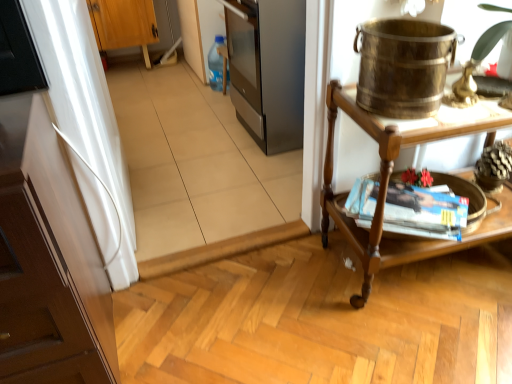
Question: Considering the relative sizes of brass metallic bucket at upper right and wooden table at right in the image provided, is brass metallic bucket at upper right smaller than wooden table at right?

Choices:
 (A) yes
 (B) no

Answer: (A)

Question: Is brass metallic bucket at upper right shorter than wooden table at right?

Choices:
 (A) yes
 (B) no

Answer: (A)

Question: Is the position of brass metallic bucket at upper right less distant than that of wooden table at right?

Choices:
 (A) no
 (B) yes

Answer: (B)

Question: Is brass metallic bucket at upper right looking in the opposite direction of wooden table at right?

Choices:
 (A) no
 (B) yes

Answer: (A)

Question: Can you confirm if brass metallic bucket at upper right is wider than wooden table at right?

Choices:
 (A) no
 (B) yes

Answer: (A)

Question: From a real-world perspective, is wooden cabinet at upper left, positioned as the 2th cabinetry in right-to-left order, physically located above or below matte brown magazine at right?

Choices:
 (A) above
 (B) below

Answer: (A)

Question: Do you think wooden cabinet at upper left, the 2th cabinetry when ordered from front to back, is within matte brown magazine at right, or outside of it?

Choices:
 (A) inside
 (B) outside

Answer: (B)

Question: Considering the positions of wooden cabinet at upper left, marked as the 1th cabinetry in a back-to-front arrangement, and matte brown magazine at right in the image, is wooden cabinet at upper left, marked as the 1th cabinetry in a back-to-front arrangement, taller or shorter than matte brown magazine at right?

Choices:
 (A) tall
 (B) short

Answer: (A)

Question: Is wooden cabinet at upper left, which is counted as the second cabinetry, starting from the bottom, to the left or to the right of matte brown magazine at right in the image?

Choices:
 (A) left
 (B) right

Answer: (A)

Question: From the image's perspective, relative to matte brown magazine at right, is wooden table at right above or below?

Choices:
 (A) below
 (B) above

Answer: (B)

Question: In terms of size, does wooden table at right appear bigger or smaller than matte brown magazine at right?

Choices:
 (A) small
 (B) big

Answer: (B)

Question: From a real-world perspective, is wooden table at right physically located above or below matte brown magazine at right?

Choices:
 (A) above
 (B) below

Answer: (A)

Question: Choose the correct answer: Is wooden table at right inside matte brown magazine at right or outside it?

Choices:
 (A) outside
 (B) inside

Answer: (A)

Question: Is brass metallic bucket at upper right wider or thinner than matte brown magazine at right?

Choices:
 (A) thin
 (B) wide

Answer: (A)

Question: Do you think brass metallic bucket at upper right is within matte brown magazine at right, or outside of it?

Choices:
 (A) inside
 (B) outside

Answer: (B)